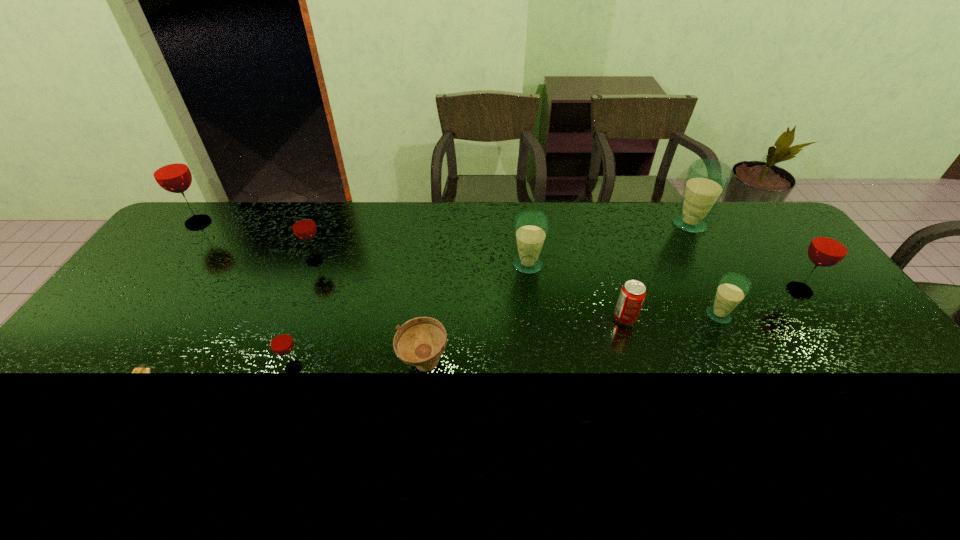
In order to click on vacant area that lies between the second nearest glass and the farthest blue glass in this screenshot , I will do `click(704, 269)`.

Locate an element on the screen. free space between the fourth glass from left to right and the second farthest red glass is located at coordinates (421, 262).

Point out which object is positioned as the third nearest to the nearest glass. Please provide its 2D coordinates. Your answer should be formatted as a tuple, i.e. [(x, y)], where the tuple contains the x and y coordinates of a point satisfying the conditions above.

[(303, 225)]

Locate which object is the third closest to the fourth glass from right to left. Please provide its 2D coordinates. Your answer should be formatted as a tuple, i.e. [(x, y)], where the tuple contains the x and y coordinates of a point satisfying the conditions above.

[(732, 289)]

Locate an element on the screen. The image size is (960, 540). glass identified as the fourth closest to the fourth glass from right to left is located at coordinates (281, 343).

Identify which glass is located as the sixth nearest to the biggest blue glass. Please provide its 2D coordinates. Your answer should be formatted as a tuple, i.e. [(x, y)], where the tuple contains the x and y coordinates of a point satisfying the conditions above.

[(170, 171)]

This screenshot has height=540, width=960. Find the location of `red glass that can be found as the fourth closest to the sixth farthest glass`. red glass that can be found as the fourth closest to the sixth farthest glass is located at coordinates (170, 171).

Locate which red glass is the fourth closest to the nearest blue glass. Please provide its 2D coordinates. Your answer should be formatted as a tuple, i.e. [(x, y)], where the tuple contains the x and y coordinates of a point satisfying the conditions above.

[(170, 171)]

The height and width of the screenshot is (540, 960). Find the location of `blue glass that is the nearest to the soda`. blue glass that is the nearest to the soda is located at coordinates (732, 289).

Identify which blue glass is the nearest to the nearest blue glass. Please provide its 2D coordinates. Your answer should be formatted as a tuple, i.e. [(x, y)], where the tuple contains the x and y coordinates of a point satisfying the conditions above.

[(707, 179)]